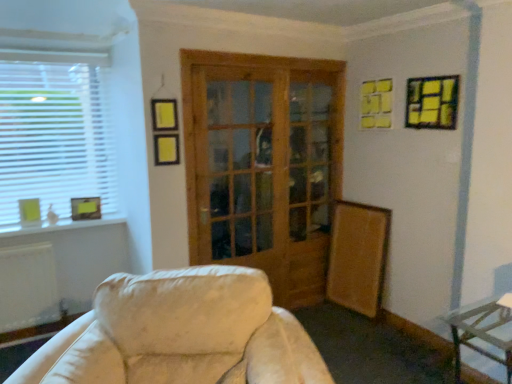
I want to click on free spot in front of matte yellow picture frame at left, the 2th picture frame when ordered from back to front, so click(x=27, y=230).